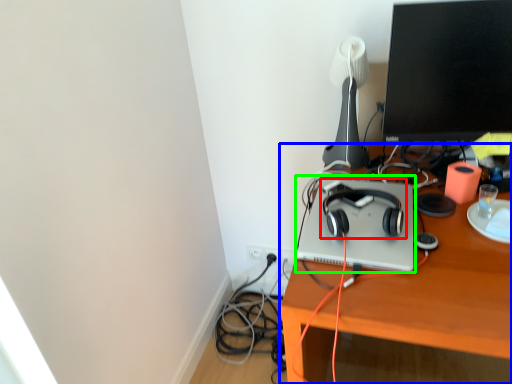
Question: Which object is the farthest from headphones (highlighted by a red box)? Choose among these: desk (highlighted by a blue box) or computer (highlighted by a green box).

Choices:
 (A) desk
 (B) computer

Answer: (A)